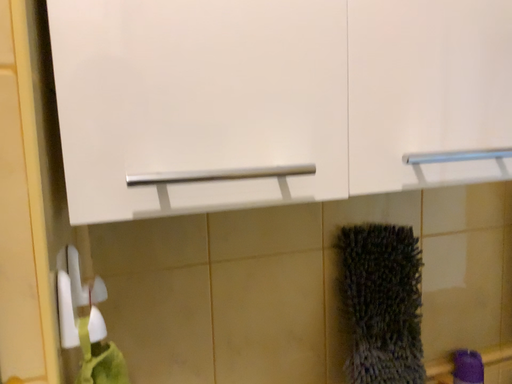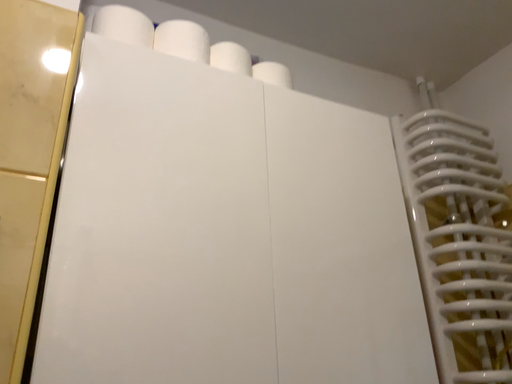
Question: How did the camera likely rotate when shooting the video?

Choices:
 (A) rotated right
 (B) rotated left

Answer: (A)